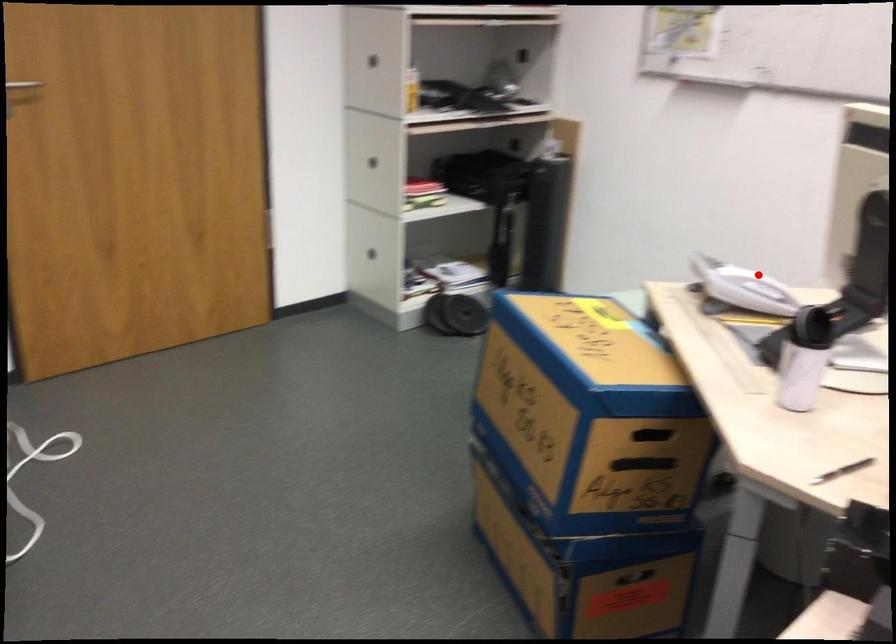
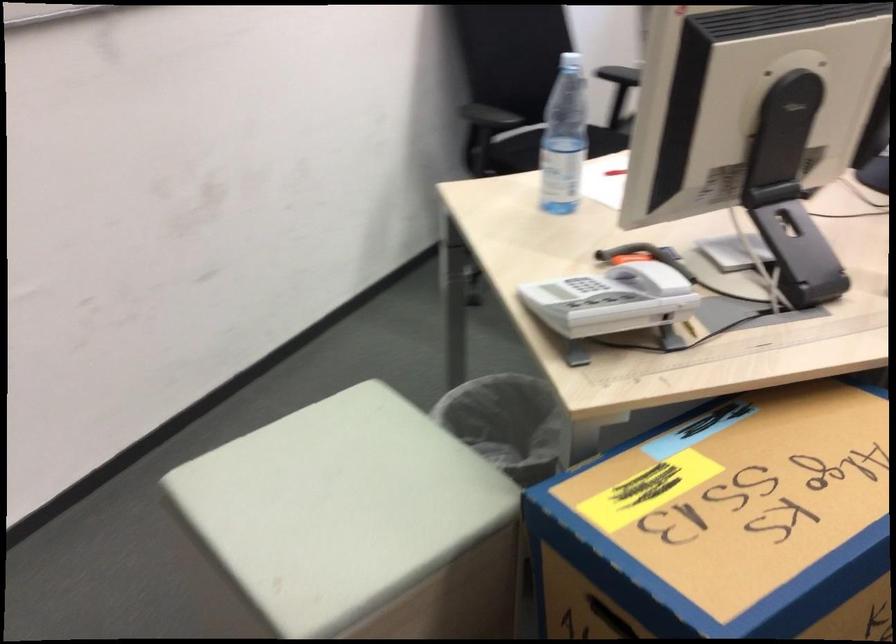
Question: I am providing you with two images of the same scene from different viewpoints. Image1 has a red point marked. In image2, the corresponding 3D location appears at what relative position? Reply with the corresponding letter.

Choices:
 (A) Closer
 (B) Farther

Answer: (A)